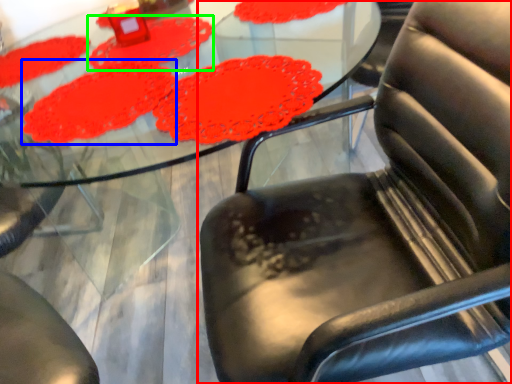
Question: Based on their relative distances, which object is farther from chair (highlighted by a red box)? Choose from mat (highlighted by a blue box) and mat (highlighted by a green box).

Choices:
 (A) mat
 (B) mat

Answer: (B)